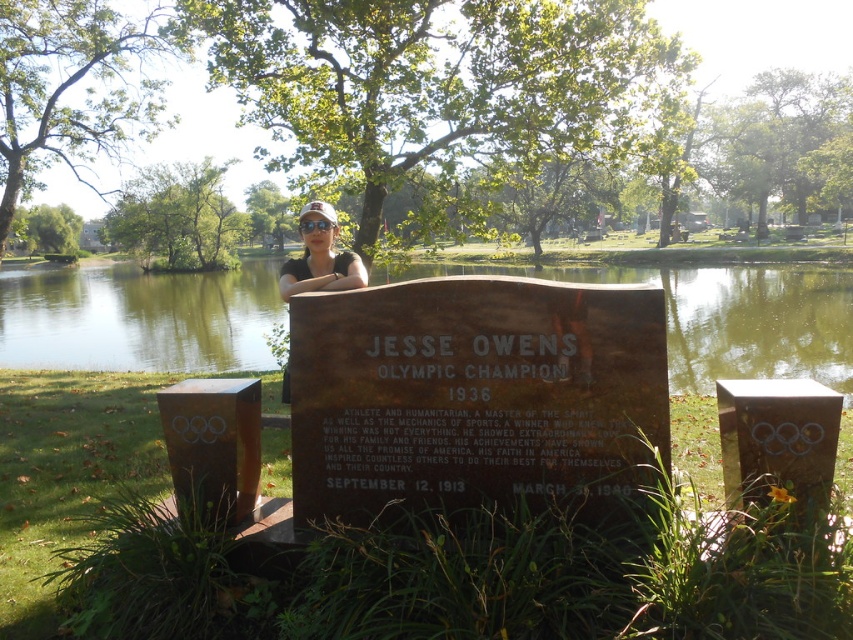
You are standing in the serene outdoor setting depicted in the image. You want to toss a pebble into the green water at pond center. If your arm can reach 2 meters, will you be able to reach the water without moving closer?

The green water at pond center is 2.97 meters away from you. Since your arm can only reach 2 meters, you cannot reach the water without moving closer.